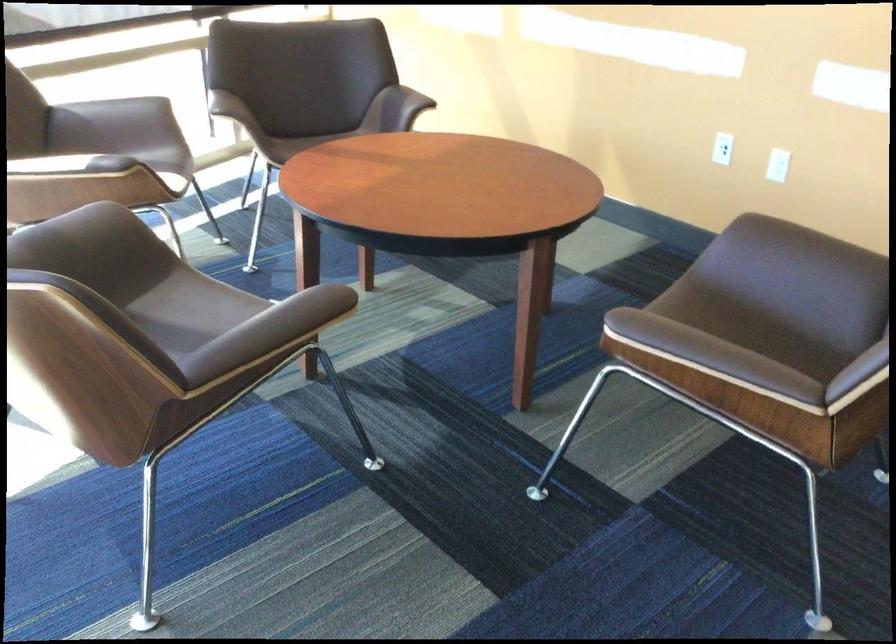
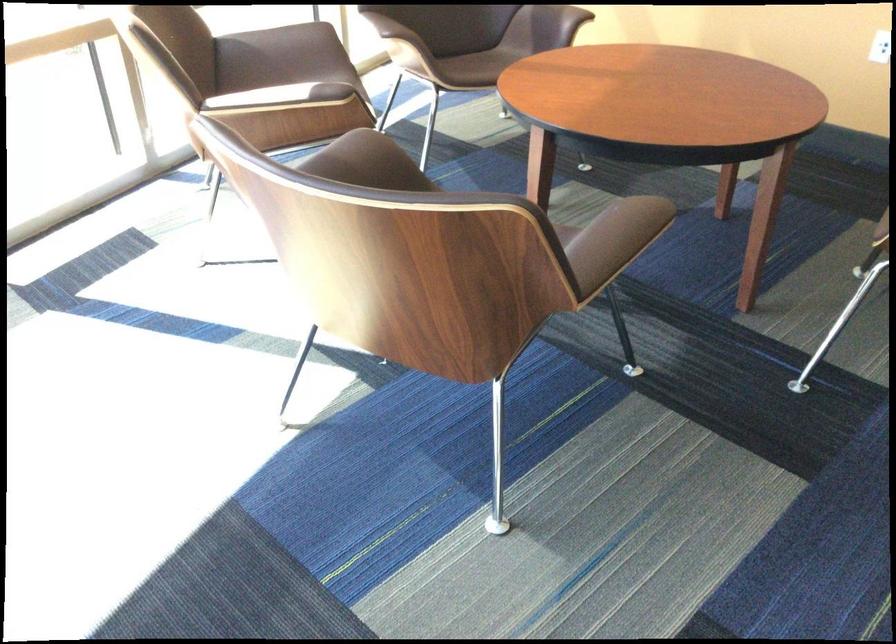
Locate, in the second image, the point that corresponds to pixel 271 330 in the first image.

(614, 240)